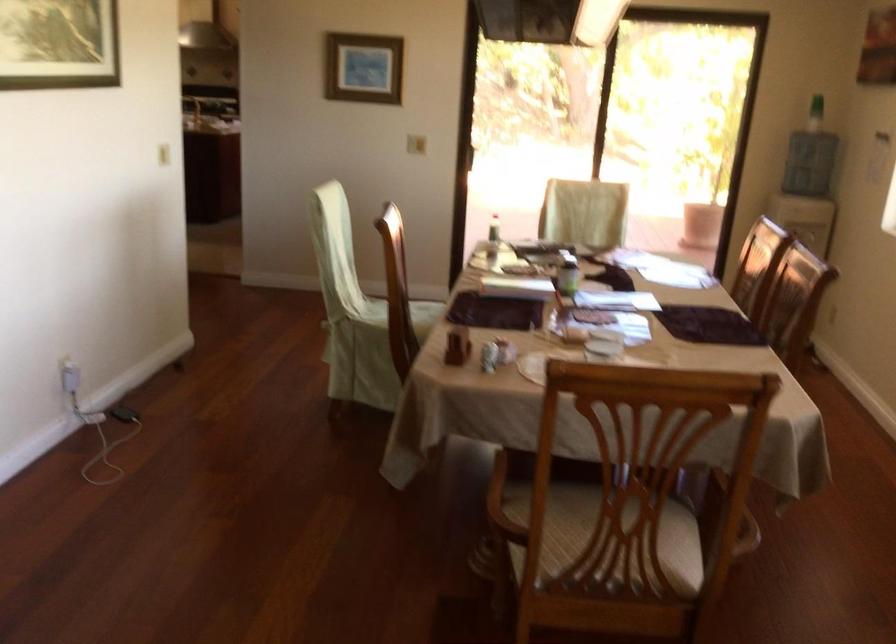
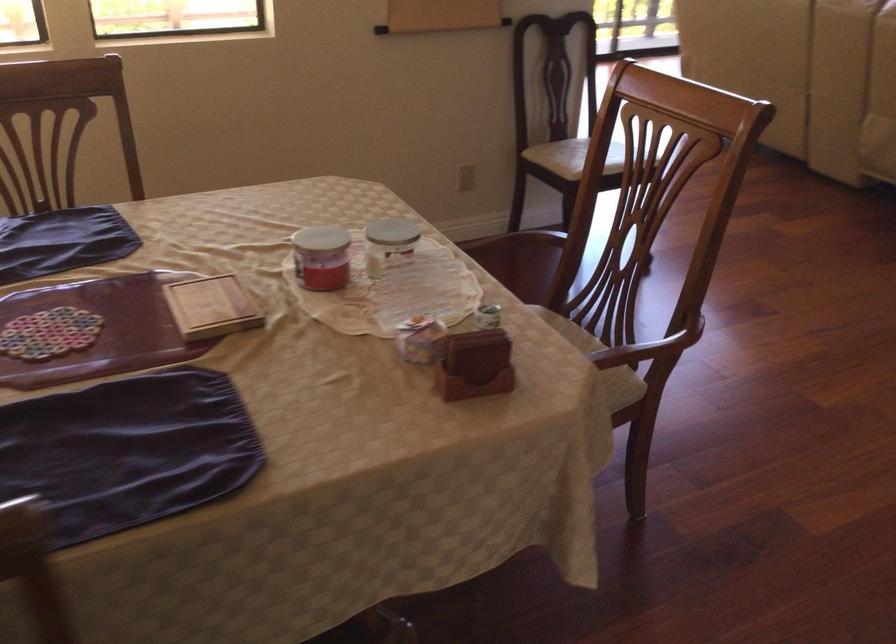
Where in the second image is the point corresponding to (590,330) from the first image?

(211, 307)